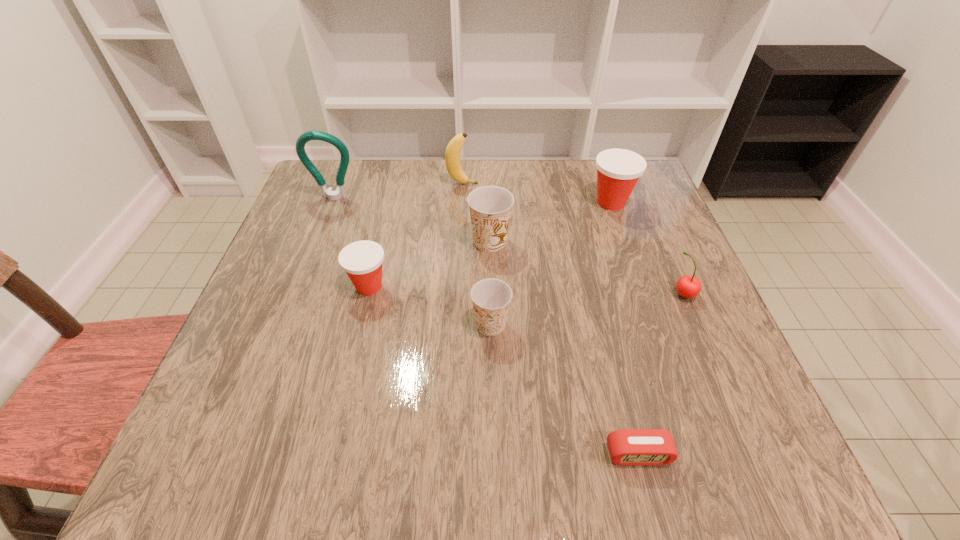
At what (x,y) coordinates should I click in order to perform the action: click on vacant space located on the back of the cherry. Please return your answer as a coordinate pair (x, y). Image resolution: width=960 pixels, height=540 pixels. Looking at the image, I should click on pyautogui.click(x=635, y=180).

At what (x,y) coordinates should I click in order to perform the action: click on free point located 0.130m on the front of the nearer red-orange Dixie cup. Please return your answer as a coordinate pair (x, y). Image resolution: width=960 pixels, height=540 pixels. Looking at the image, I should click on (352, 356).

The width and height of the screenshot is (960, 540). In order to click on free spot located 0.050m on the front of the nearest Dixie cup in this screenshot , I will do `click(492, 363)`.

Find the location of a particular element. This screenshot has width=960, height=540. bottle opener that is at the far edge is located at coordinates pos(340,192).

Locate an element on the screen. banana that is at the far edge is located at coordinates (452, 154).

Locate an element on the screen. The image size is (960, 540). Dixie cup positioned at the far edge is located at coordinates (618, 170).

Where is `object positioned at the near edge`? The height and width of the screenshot is (540, 960). object positioned at the near edge is located at coordinates (634, 447).

At what (x,y) coordinates should I click in order to perform the action: click on object that is at the left edge. Please return your answer as a coordinate pair (x, y). This screenshot has height=540, width=960. Looking at the image, I should click on (340, 192).

At what (x,y) coordinates should I click in order to perform the action: click on Dixie cup at the right edge. Please return your answer as a coordinate pair (x, y). The width and height of the screenshot is (960, 540). Looking at the image, I should click on (618, 170).

The width and height of the screenshot is (960, 540). I want to click on cherry located in the right edge section of the desktop, so click(x=688, y=286).